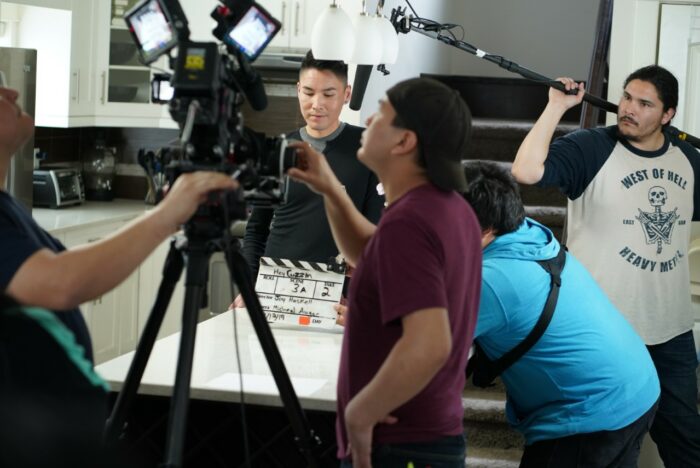
The width and height of the screenshot is (700, 468). I want to click on white table top, center, so [x=326, y=365].